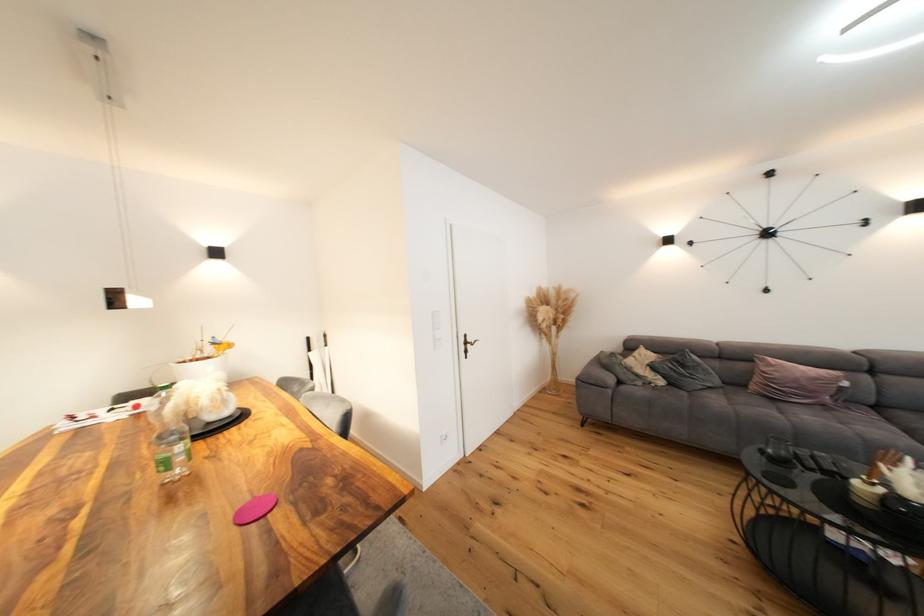
Find the location of a particular element. The height and width of the screenshot is (616, 924). black door handle is located at coordinates (467, 344).